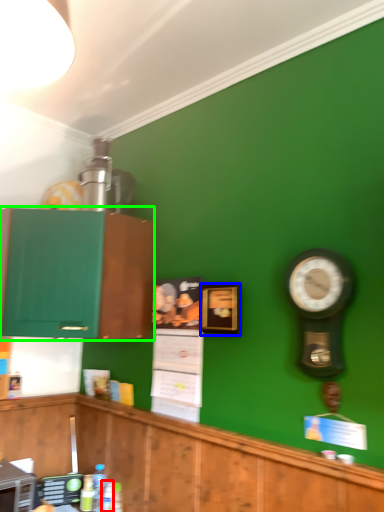
Question: Estimate the real-world distances between objects in this image. Which object is closer to bottle (highlighted by a red box), picture frame (highlighted by a blue box) or cabinetry (highlighted by a green box)?

Choices:
 (A) picture frame
 (B) cabinetry

Answer: (B)